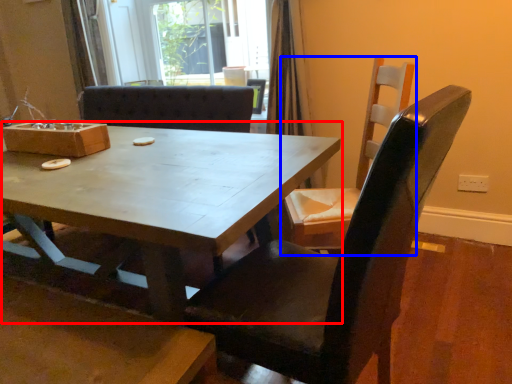
Question: Which point is closer to the camera, coffee table (highlighted by a red box) or chair (highlighted by a blue box)?

Choices:
 (A) coffee table
 (B) chair

Answer: (A)